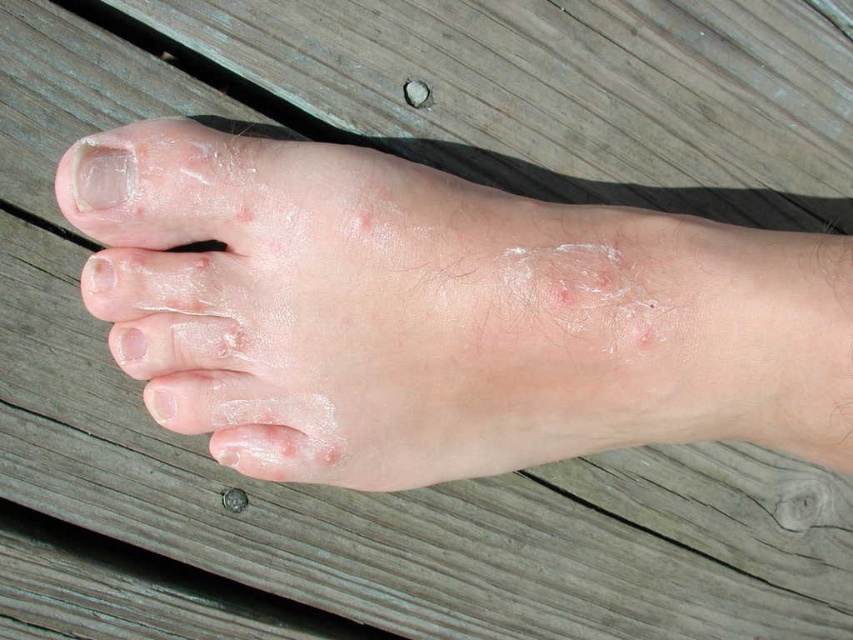
You are a dermatologist examining a patient. The patient has a foot resting on a wooden deck. You notice a point marked at coordinates (450, 316) on the image. Based on the scene description, what condition is indicated at that point?

The point at (450, 316) marks dry skin at center, which is indicated by the red and slightly scaly appearance described in the scene.

You are a dermatologist examining a patient. You notice the dry skin at center and the white matte nail at upper left. Based on their relative sizes, which condition might be more concerning and why?

The dry skin at center is taller than the white matte nail at upper left, indicating it may be more elevated or inflamed, which could suggest a more concerning condition requiring further evaluation.

You are a dermatologist examining the foot shown in the image. You notice the dry skin at center and the white matte nail at upper left. Based on their positions, which one is closer to the viewer?

The dry skin at center is closer to the viewer because it is in front of the white matte nail at upper left.